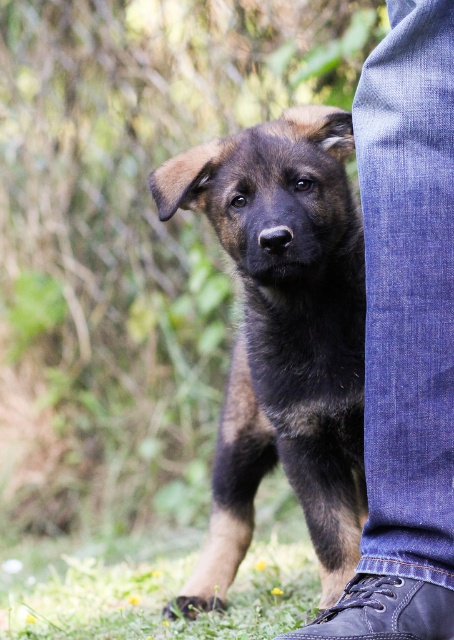
You are a photographer trying to capture a photo of the brown fur puppy at center and the denim pants at lower right. From the photographer perspective, which object is positioned to the right?

The denim pants at lower right are positioned to the right of the brown fur puppy at center.

You are taking a photo of the puppy and want to focus on the point closer to the camera. Which point should you select between point (420, 182) and point (385, 609)?

Point (420, 182) is further to the camera than point (385, 609), so you should select point (420, 182) to focus on the closer point.